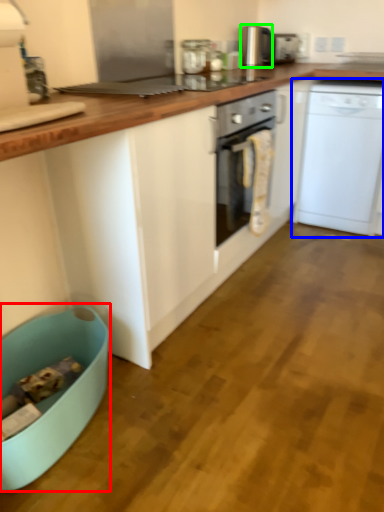
Question: Which is farther away from dish washer (highlighted by a red box)? home appliance (highlighted by a blue box) or kitchen appliance (highlighted by a green box)?

Choices:
 (A) home appliance
 (B) kitchen appliance

Answer: (B)